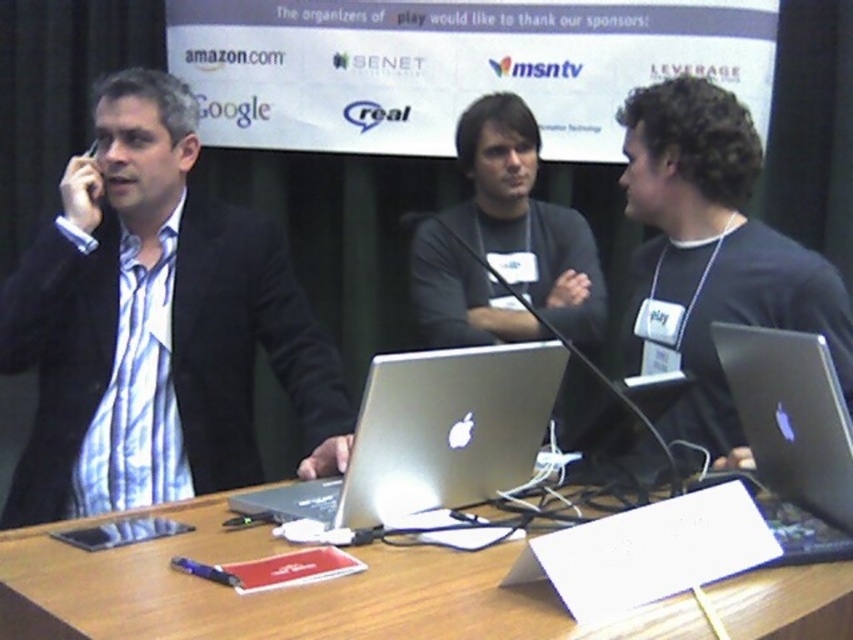
Is silver metallic laptop at center taller than satin silver laptop at right?

Incorrect, silver metallic laptop at center's height is not larger of satin silver laptop at right's.

Between silver metallic laptop at center and satin silver laptop at right, which one appears on the left side from the viewer's perspective?

From the viewer's perspective, silver metallic laptop at center appears more on the left side.

Between point (457, 355) and point (802, 481), which one is positioned in front?

Point (457, 355) is more forward.

In order to click on silver metallic laptop at center in this screenshot , I will do `click(432, 435)`.

Does wooden table at center appear on the left side of matte black laptop at right?

Correct, you'll find wooden table at center to the left of matte black laptop at right.

Does wooden table at center appear on the right side of matte black laptop at right?

Incorrect, wooden table at center is not on the right side of matte black laptop at right.

This screenshot has width=853, height=640. Find the location of `wooden table at center`. wooden table at center is located at coordinates (289, 593).

Between point (747, 157) and point (431, 381), which one is positioned in front?

Point (431, 381) is more forward.

Does point (691, 140) come behind point (440, 467)?

Yes.

Which is in front, point (734, 230) or point (442, 500)?

Point (442, 500) is in front.

You are a GUI agent. You are given a task and a screenshot of the screen. Output one action in this format:
    pyautogui.click(x=<x>, y=<y>)
    Task: Click on the matte black laptop at right
    
    Given the screenshot: What is the action you would take?
    pyautogui.click(x=715, y=248)